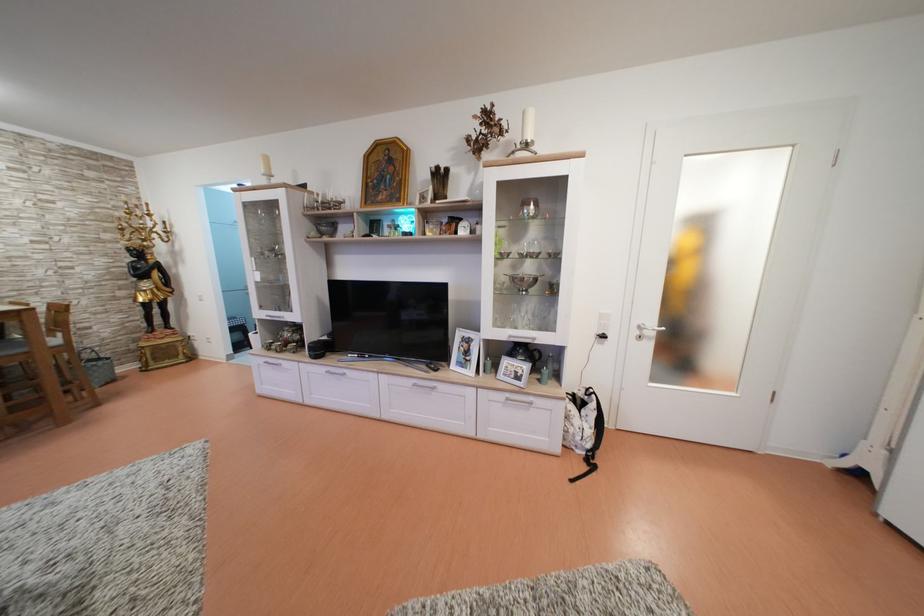
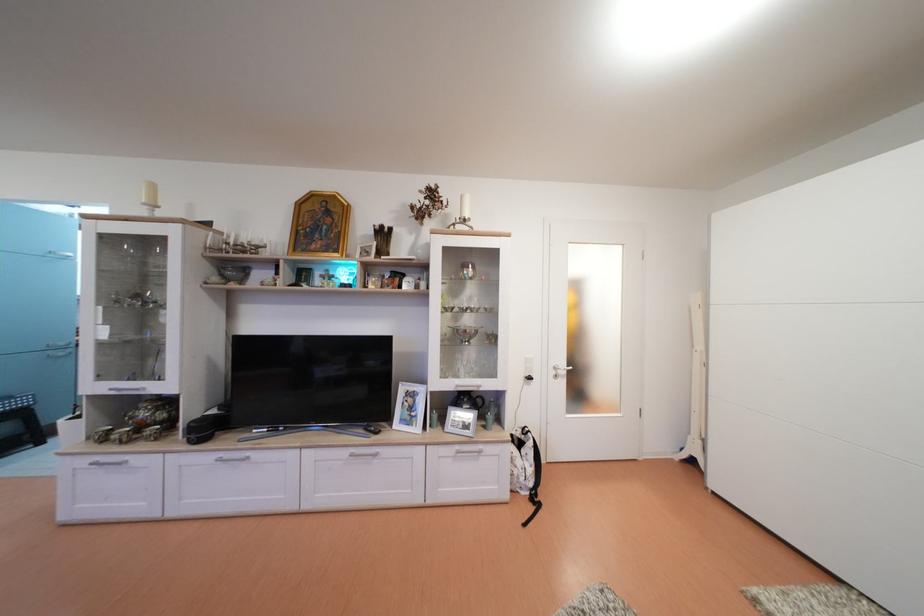
Question: The images are taken continuously from a first-person perspective. In which direction are you moving?

Choices:
 (A) Left
 (B) Right
 (C) Forward
 (D) Backward

Answer: (A)